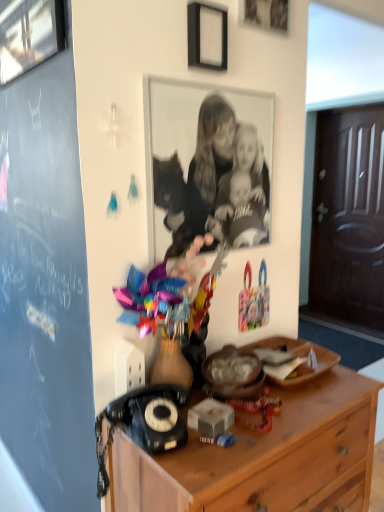
What are the coordinates of `blank space situated above wooden chest of drawers at lower right (from a real-world perspective)` in the screenshot? It's located at [262, 401].